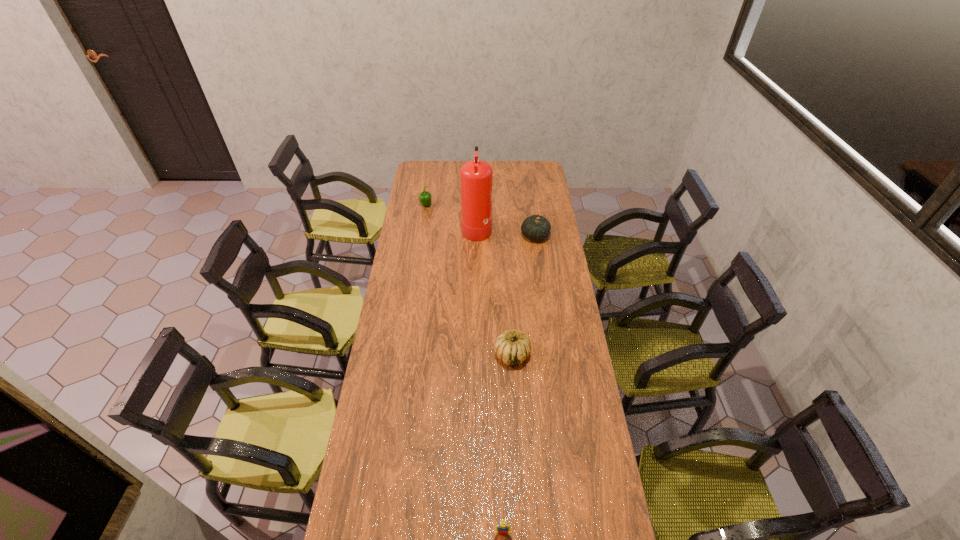
Locate an element on the screen. This screenshot has height=540, width=960. vacant area that lies between the farthest object and the fire extinguisher is located at coordinates (451, 216).

The image size is (960, 540). What are the coordinates of `unoccupied position between the left gourd and the right gourd` in the screenshot? It's located at (523, 295).

Find the location of a particular element. empty space between the tallest object and the right gourd is located at coordinates (506, 231).

Locate an element on the screen. The width and height of the screenshot is (960, 540). free area in between the farthest object and the shortest object is located at coordinates (465, 369).

Locate an element on the screen. The image size is (960, 540). free space between the rightmost object and the left gourd is located at coordinates (523, 295).

The width and height of the screenshot is (960, 540). Identify the location of blank region between the fire extinguisher and the rightmost object. (506, 231).

Identify the location of vacant area that lies between the nearest object and the farther gourd. The width and height of the screenshot is (960, 540). (518, 384).

Identify the location of free space between the bell pepper and the second nearest object. (469, 280).

Identify which object is the fourth closest to the nearest object. Please provide its 2D coordinates. Your answer should be formatted as a tuple, i.e. [(x, y)], where the tuple contains the x and y coordinates of a point satisfying the conditions above.

[(425, 197)]

Select which object is the closest to the shortest object. Please provide its 2D coordinates. Your answer should be formatted as a tuple, i.e. [(x, y)], where the tuple contains the x and y coordinates of a point satisfying the conditions above.

[(512, 347)]